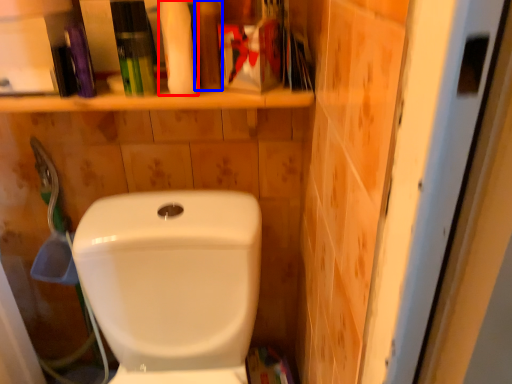
Question: Which point is further to the camera, cleaning product (highlighted by a red box) or toiletry (highlighted by a blue box)?

Choices:
 (A) cleaning product
 (B) toiletry

Answer: (B)